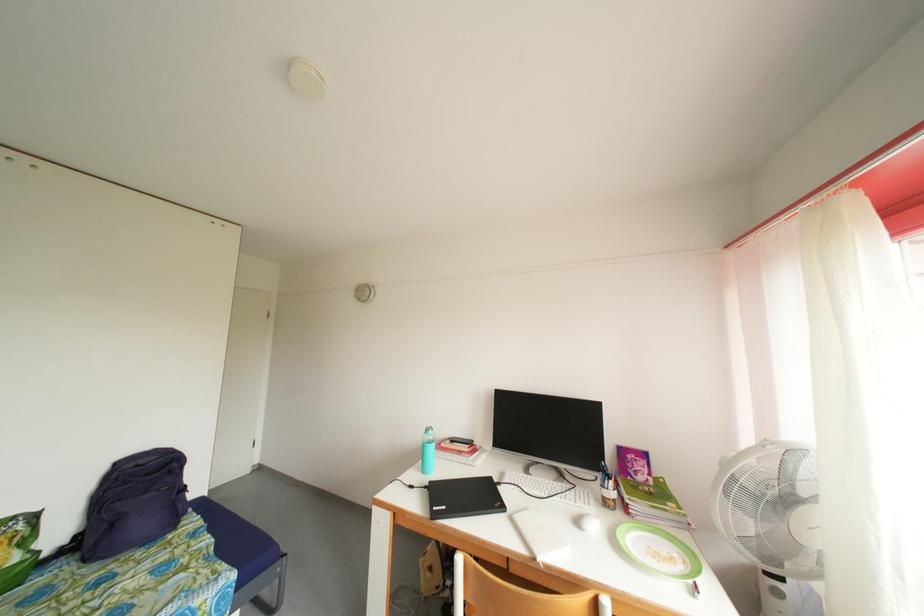
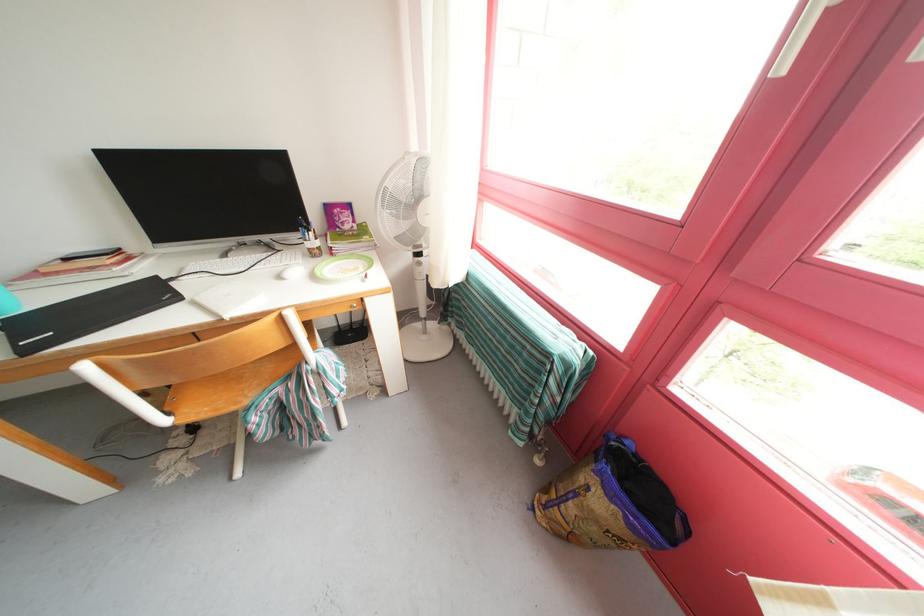
The point at (617, 484) is marked in the first image. Where is the corresponding point in the second image?

(315, 236)